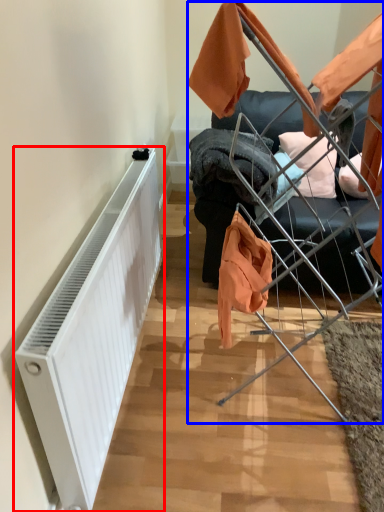
Question: Which point is further to the camera, radiator (highlighted by a red box) or baby carriage (highlighted by a blue box)?

Choices:
 (A) radiator
 (B) baby carriage

Answer: (B)